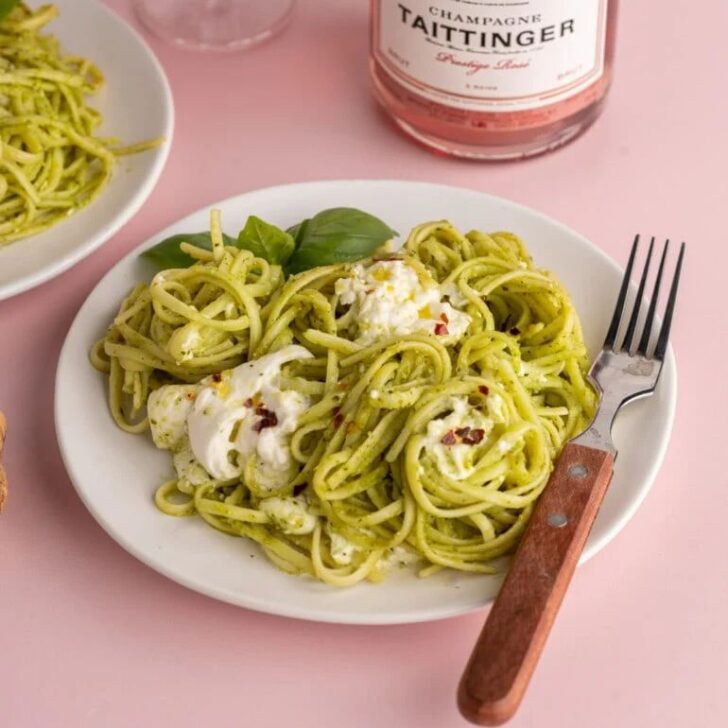
Where is `wooden handle of the fork`? This screenshot has height=728, width=728. wooden handle of the fork is located at coordinates (530, 563).